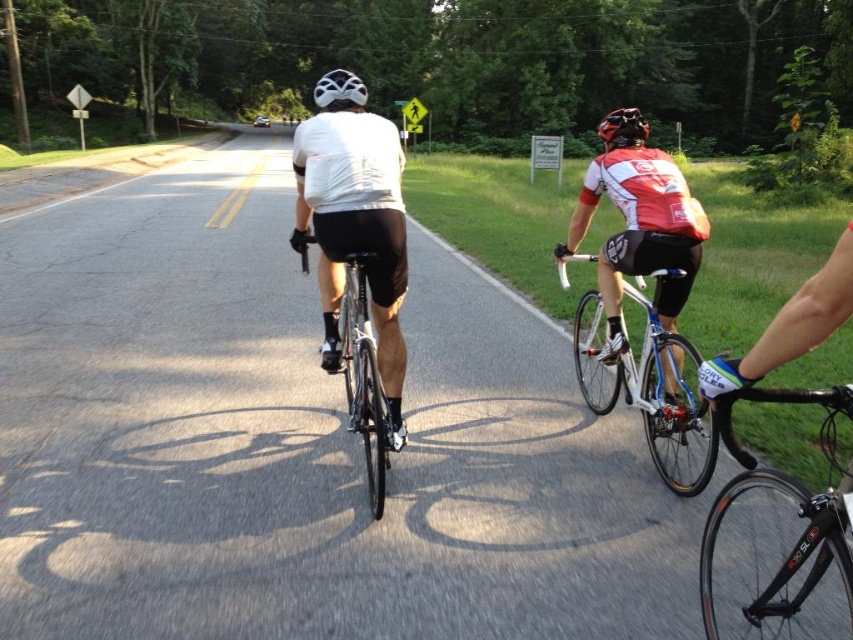
You are a photographer trying to capture the cyclists. You want to focus on the shiny silver bicycle at center without the white jersey at center blocking the view. Is there a way to adjust your position to avoid the jersey?

The white jersey at center is positioned over the shiny silver bicycle at center, so moving your camera angle downward might allow you to capture the bicycle without the jersey blocking it.

You are a photographer standing behind the cyclists and want to capture a photo where the matte black bicycle at center is clearly visible above the white matte bicycle helmet at upper center. Based on their current positions, is this possible?

The matte black bicycle at center has a lesser height compared to the white matte bicycle helmet at upper center, so it is not possible to capture the matte black bicycle at center above the white matte bicycle helmet at upper center in the current positions.

You are a pedestrian standing at the side of the road and want to cross to the other side. There are two objects in your view ahead of you on the road. The first is a cyclist wearing a white jersey at center, and the second is a matte black bicycle at center. Which object should you wait for before crossing safely?

You should wait for the white jersey at center because it is closer to you than the matte black bicycle at center, so you need to ensure it has passed before crossing safely.